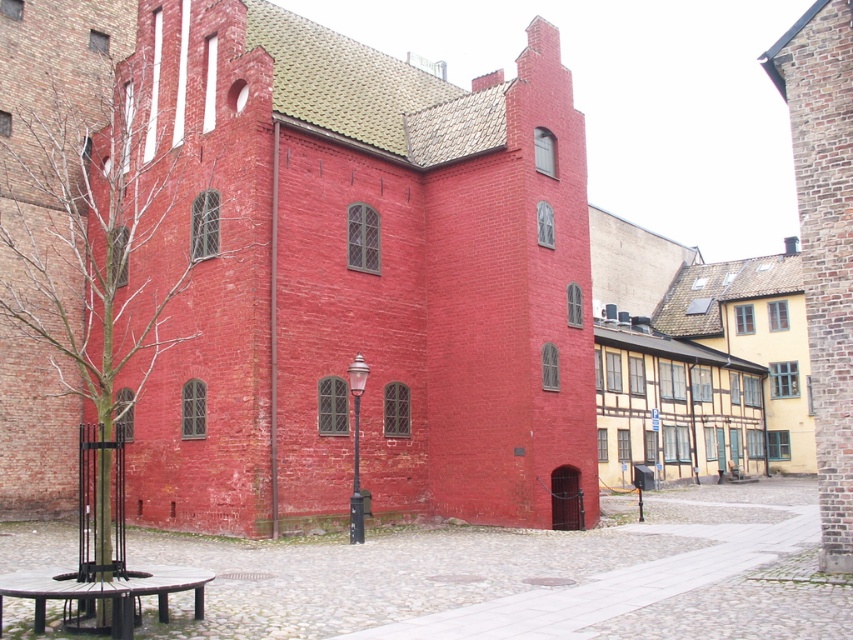
Question: Can you confirm if brick textured church at center is positioned above black polished stone picnic table at lower left?

Choices:
 (A) yes
 (B) no

Answer: (A)

Question: Is brick textured church at center above black polished stone picnic table at lower left?

Choices:
 (A) no
 (B) yes

Answer: (B)

Question: Where is brick textured church at center located in relation to black polished stone picnic table at lower left in the image?

Choices:
 (A) below
 (B) above

Answer: (B)